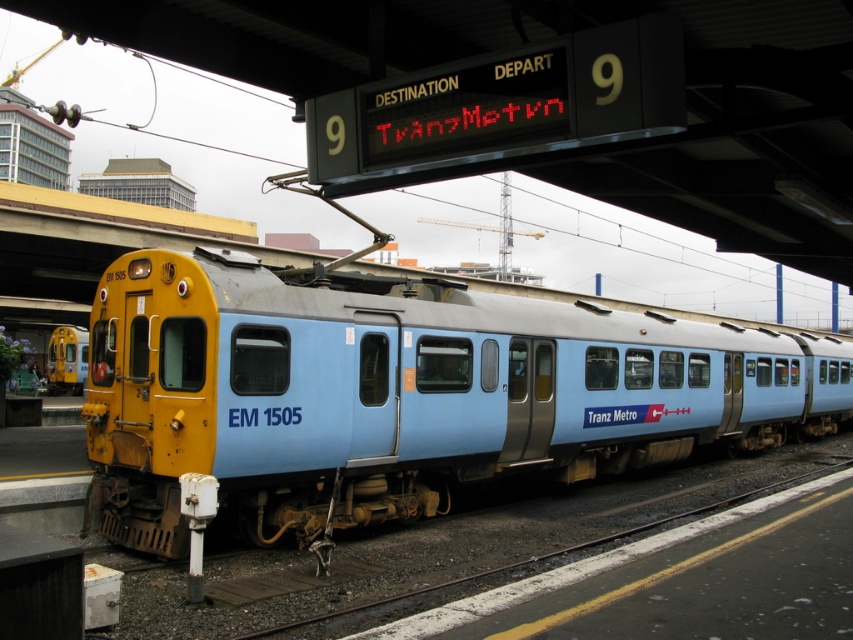
Which is more to the right, matte blue train at center or yellow matte train at left?

From the viewer's perspective, matte blue train at center appears more on the right side.

Does point (471, 406) come in front of point (49, 346)?

That is True.

Locate an element on the screen. The width and height of the screenshot is (853, 640). matte blue train at center is located at coordinates pos(402,394).